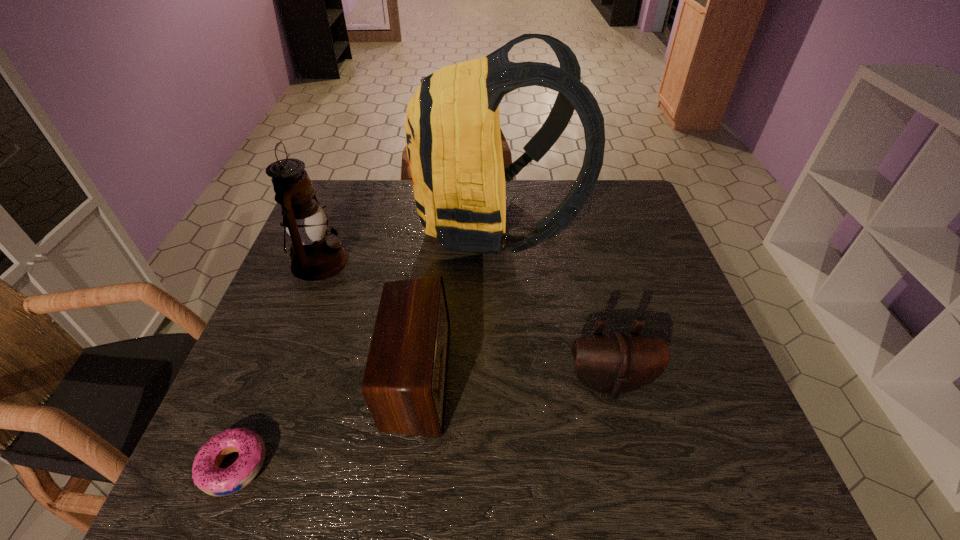
Identify the location of vacant space located with the flap open on the pouch. The image size is (960, 540). (629, 461).

Identify the location of vacant space situated 0.130m on the back of the doughnut. This screenshot has height=540, width=960. (270, 377).

What are the coordinates of `object positioned at the far edge` in the screenshot? It's located at (452, 128).

Where is `object present at the near edge`? The height and width of the screenshot is (540, 960). object present at the near edge is located at coordinates coord(207,475).

Image resolution: width=960 pixels, height=540 pixels. Find the location of `lantern located at the left edge`. lantern located at the left edge is located at coordinates [315, 255].

At what (x,y) coordinates should I click in order to perform the action: click on doughnut at the left edge. Please return your answer as a coordinate pair (x, y). This screenshot has height=540, width=960. Looking at the image, I should click on (207, 475).

Where is `object that is at the right edge`? This screenshot has height=540, width=960. object that is at the right edge is located at coordinates (613, 363).

Identify the location of object present at the near left corner. The image size is (960, 540). (207, 475).

Image resolution: width=960 pixels, height=540 pixels. Find the location of `free space at the far edge of the desktop`. free space at the far edge of the desktop is located at coordinates (385, 180).

In the image, there is a desktop. At what (x,y) coordinates should I click in order to perform the action: click on vacant space at the near edge. Please return your answer as a coordinate pair (x, y). Image resolution: width=960 pixels, height=540 pixels. Looking at the image, I should click on (647, 459).